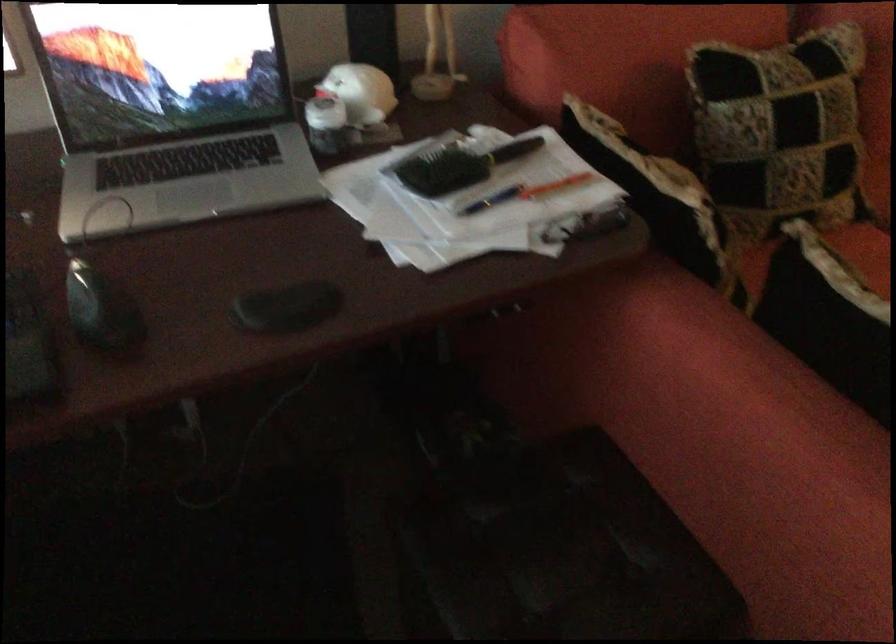
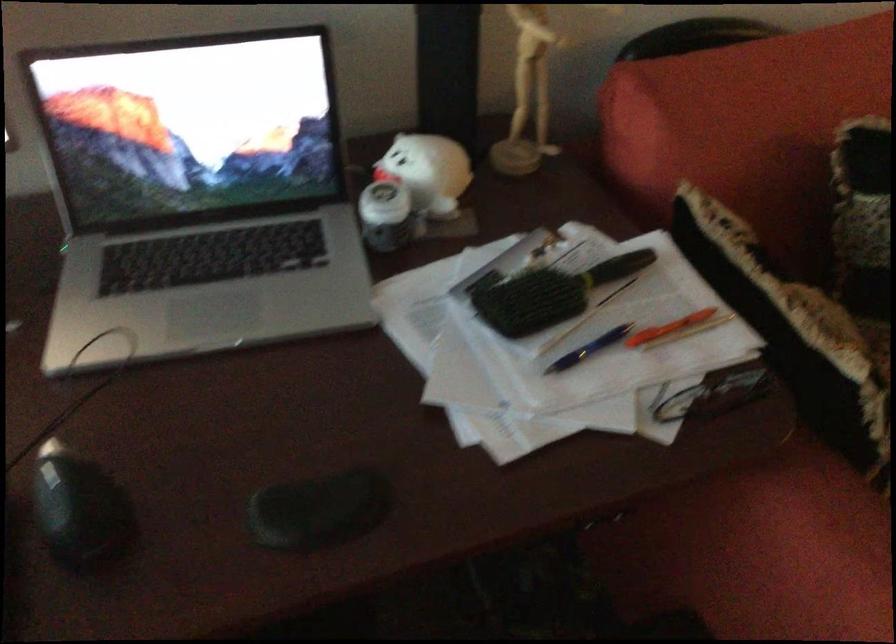
Where in the second image is the point corresponding to pixel 556 187 from the first image?

(668, 328)